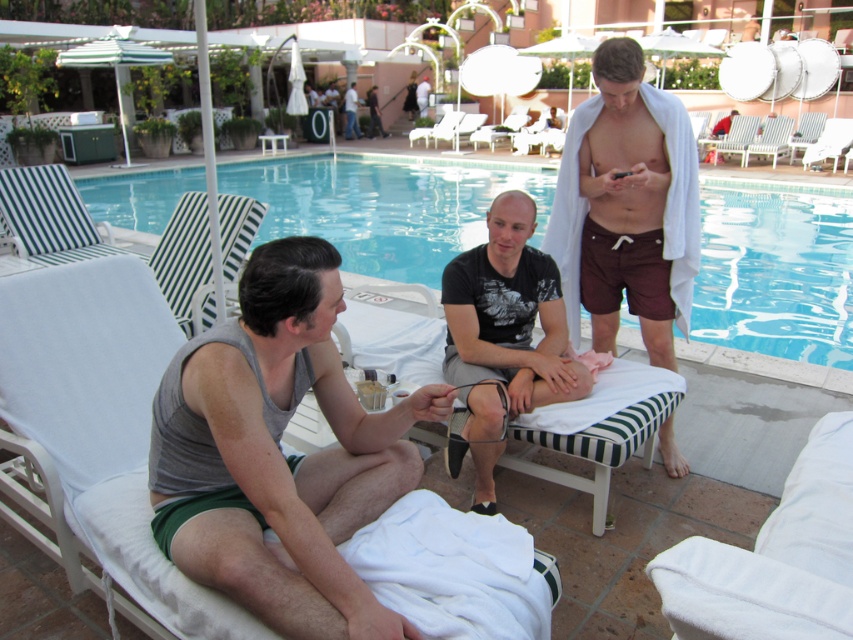
Question: Is transparent glass pool at center to the left of black matte t-shirt at center from the viewer's perspective?

Choices:
 (A) no
 (B) yes

Answer: (B)

Question: Can you confirm if maroon fabric shorts at right is positioned below black matte t-shirt at center?

Choices:
 (A) yes
 (B) no

Answer: (B)

Question: Observing the image, what is the correct spatial positioning of gray fabric tank top at center in reference to transparent glass pool at center?

Choices:
 (A) left
 (B) right

Answer: (A)

Question: Which of the following is the closest to the observer?

Choices:
 (A) black matte t-shirt at center
 (B) transparent glass pool at center

Answer: (A)

Question: Which object is farther from the camera taking this photo?

Choices:
 (A) maroon fabric shorts at right
 (B) gray fabric tank top at center

Answer: (A)

Question: Among these objects, which one is nearest to the camera?

Choices:
 (A) transparent glass pool at center
 (B) gray fabric tank top at center
 (C) maroon fabric shorts at right

Answer: (B)